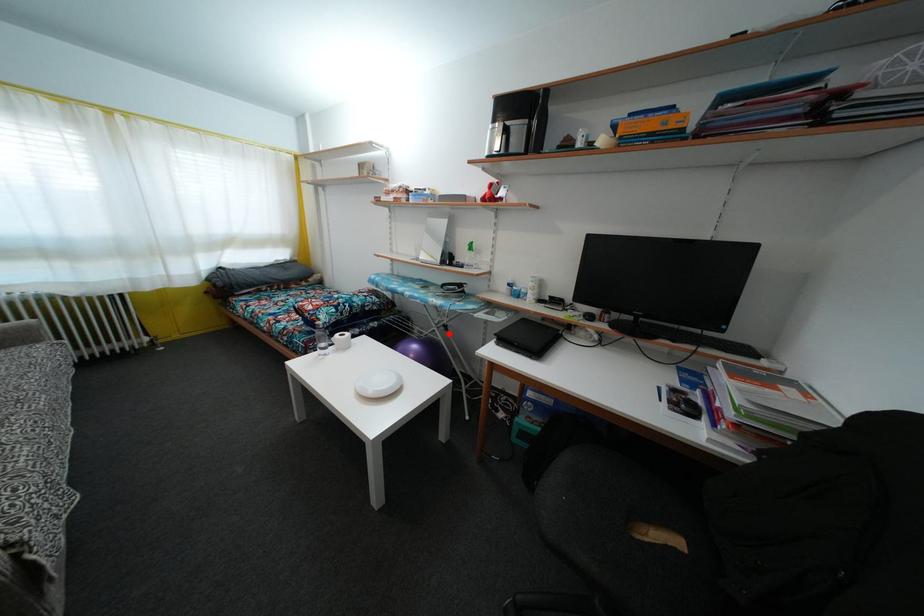
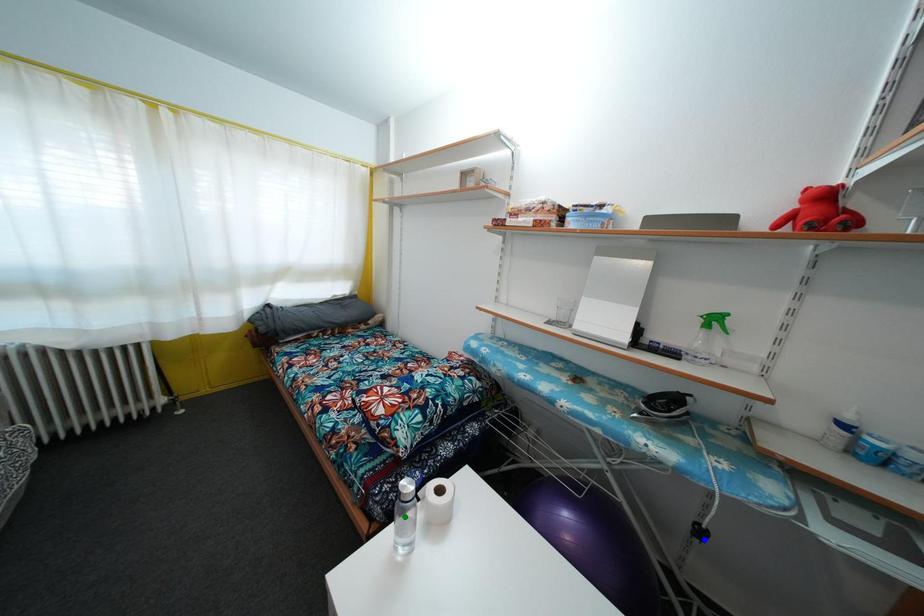
Question: I am providing you with two images of the same scene from different viewpoints. A red point is marked on the first image. You are given multiple points on the second image. Which mark in image 2 goes with the point in image 1?

Choices:
 (A) blue point
 (B) yellow point
 (C) green point

Answer: (A)